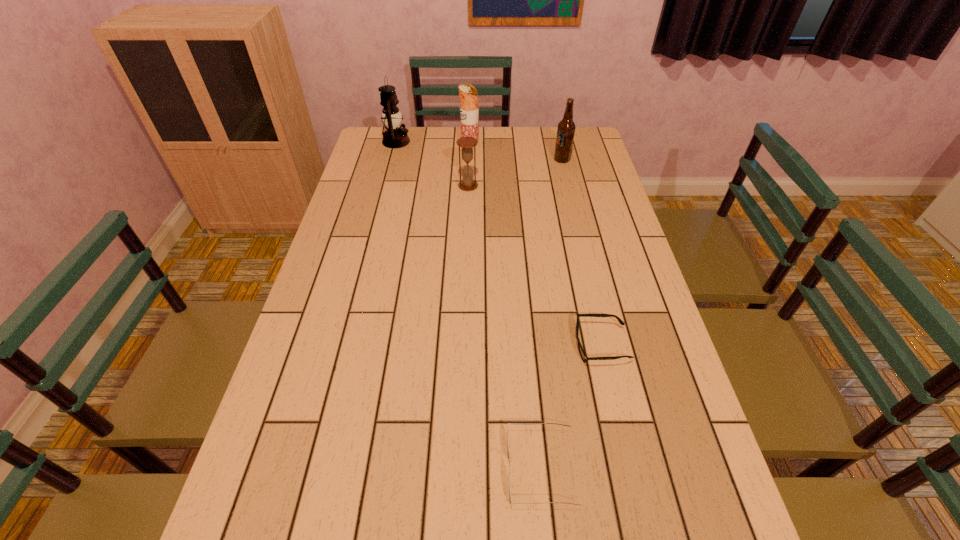
In order to click on free space located on the right of the burrito in this screenshot , I will do `click(551, 145)`.

At what (x,y) coordinates should I click in order to perform the action: click on vacant space located 0.340m on the label of the fourth nearest object. Please return your answer as a coordinate pair (x, y). This screenshot has width=960, height=540. Looking at the image, I should click on (462, 160).

Identify the location of blank space located 0.130m on the label of the fourth nearest object. (518, 160).

Find the location of a particular element. This screenshot has width=960, height=540. free space located 0.220m on the label of the fourth nearest object is located at coordinates (494, 160).

This screenshot has height=540, width=960. In order to click on vacant space situated on the back of the third shortest object in this screenshot , I will do `click(469, 134)`.

Where is `vacant space located on the front-facing side of the second nearest object`? vacant space located on the front-facing side of the second nearest object is located at coordinates (483, 346).

Identify the location of vacant point located 0.270m on the front-facing side of the second nearest object. The height and width of the screenshot is (540, 960). (462, 346).

Identify the location of free point located on the front-facing side of the second nearest object. (545, 346).

You are a GUI agent. You are given a task and a screenshot of the screen. Output one action in this format:
    pyautogui.click(x=<x>, y=<y>)
    Task: Click on the vacant space located 0.340m on the front-facing side of the nearest object
    This screenshot has height=540, width=960.
    Given the screenshot: What is the action you would take?
    pyautogui.click(x=332, y=469)

Locate an element on the screen. free space located on the front-facing side of the nearest object is located at coordinates (327, 469).